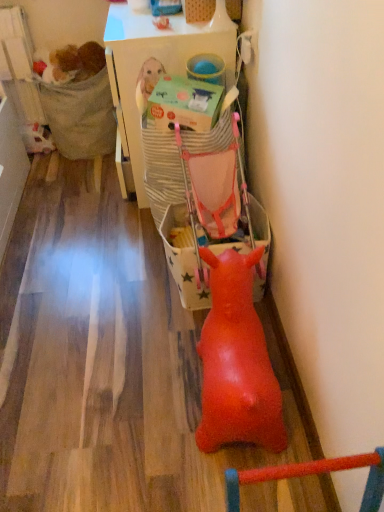
Question: Based on their sizes in the image, would you say matte green cardboard box at center is bigger or smaller than white plastic table at upper center?

Choices:
 (A) small
 (B) big

Answer: (A)

Question: Is matte green cardboard box at center wider or thinner than white plastic table at upper center?

Choices:
 (A) thin
 (B) wide

Answer: (A)

Question: Which of these objects is positioned farthest from the white plastic table at upper center?

Choices:
 (A) matte green cardboard box at center
 (B) fuzzy brown stuffed animal at upper left
 (C) rubber duck at center
 (D) textured fabric chair at left
 (E) matte pink baby carriage at center

Answer: (C)

Question: Considering the real-world distances, which object is closest to the matte green cardboard box at center?

Choices:
 (A) white plastic table at upper center
 (B) textured fabric chair at left
 (C) rubber duck at center
 (D) matte pink baby carriage at center
 (E) fuzzy brown stuffed animal at upper left

Answer: (A)